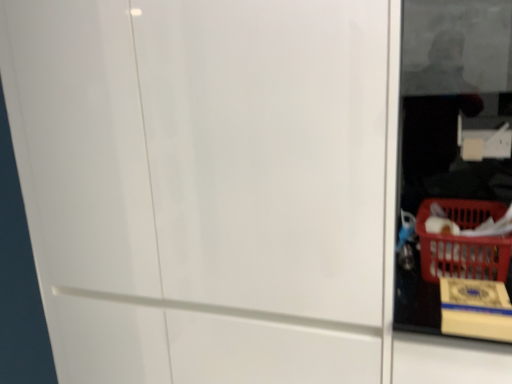
Question: Considering their positions, is white glossy screen door at center located in front of or behind red plastic basket at lower right?

Choices:
 (A) front
 (B) behind

Answer: (A)

Question: Is white glossy screen door at center taller or shorter than red plastic basket at lower right?

Choices:
 (A) tall
 (B) short

Answer: (A)

Question: Which object is the farthest from the red plastic basket at lower right?

Choices:
 (A) white glossy screen door at center
 (B) yellow cardboard box at lower right

Answer: (A)

Question: Which is farther from the red plastic basket at lower right?

Choices:
 (A) yellow cardboard box at lower right
 (B) white glossy screen door at center

Answer: (B)